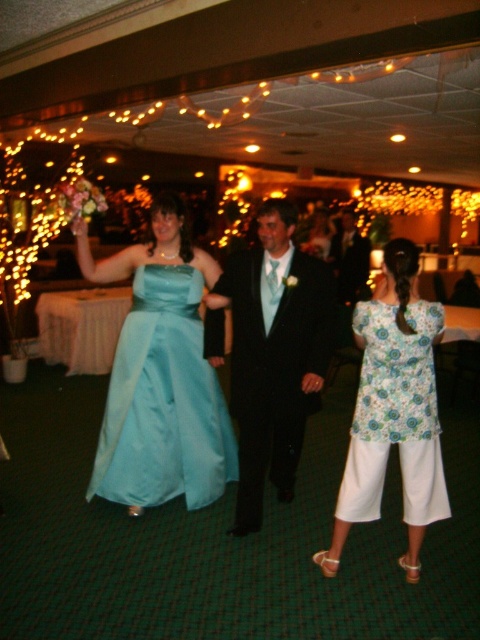
You are a photographer at this event and need to capture a photo that includes both the matte blue dress at center and the light blue satin dress at center. Which dress should you position to the left in your camera frame to match their actual positions?

The light blue satin dress at center should be positioned to the left in the camera frame because the matte blue dress at center is on the right side of it in reality.

In the scene shown: You are a photographer at the event and need to decide which dress to focus on for a closeup shot. Since the matte blue dress at center is larger than the light blue satin dress at center, which dress should you choose to ensure it fills the frame without cropping?

The matte blue dress at center is bigger than the light blue satin dress at center, so you should choose the matte blue dress at center to fill the frame without cropping.